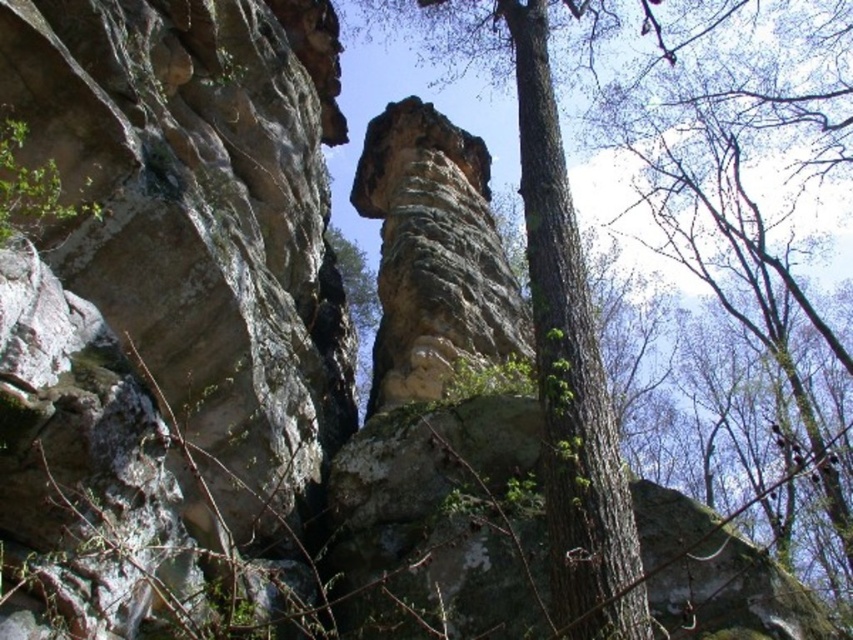
You are standing in front of the natural rock formation and want to take a photo of both the green mossy bark tree at center and the rusty stone column at center. Which object should you focus on first to ensure both are in sharp focus?

You should focus on the green mossy bark tree at center first because it is closer to the viewer than the rusty stone column at center. By focusing on the closer object, the depth of field may extend to include the farther object in acceptable focus.

You are a hiker trying to navigate through the rocky terrain. You see a green mossy bark tree at center and a rusty stone column at center. Which object would you choose to climb if you need to reach a higher elevation quickly?

The green mossy bark tree at center is bigger than the rusty stone column at center, so it would provide a higher elevation to climb.